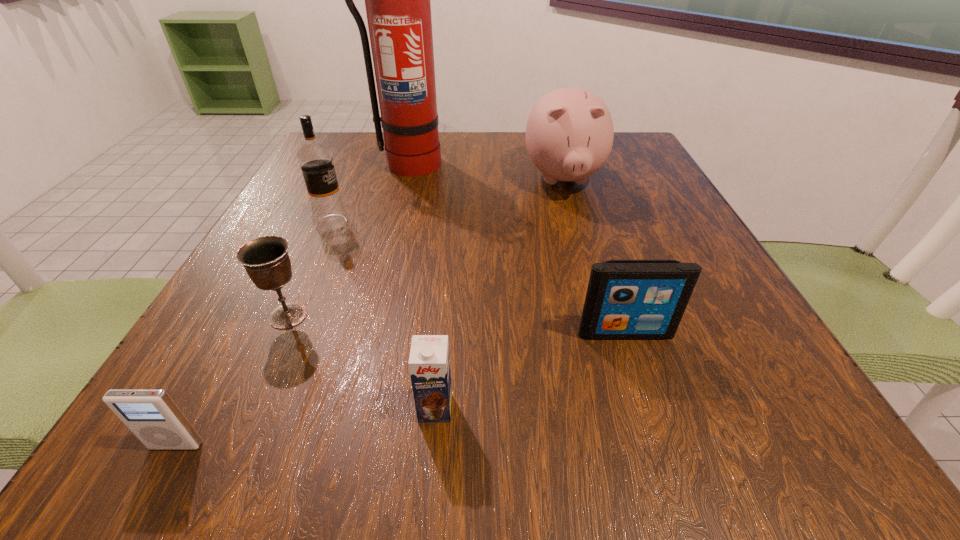
Where is `vacant area that lies between the fifth nearest object and the chalice`? The image size is (960, 540). vacant area that lies between the fifth nearest object and the chalice is located at coordinates (310, 269).

The width and height of the screenshot is (960, 540). Identify the location of object that is the second closest to the chalice. [x=315, y=159].

Identify the location of the closest object to the tallest object. (315, 159).

Identify the location of free point that satisfies the following two spatial constraints: 1. at the snout of the piggy bank; 2. on the label of the vodka. (576, 223).

Identify the location of free space in the image that satisfies the following two spatial constraints: 1. on the label side of the tallest object; 2. on the label of the vodka. (391, 223).

I want to click on vacant region that satisfies the following two spatial constraints: 1. on the label of the vodka; 2. on the front-facing side of the shorter iPod, so click(x=232, y=446).

The image size is (960, 540). I want to click on vacant space that satisfies the following two spatial constraints: 1. on the label side of the tallest object; 2. on the label of the vodka, so click(391, 223).